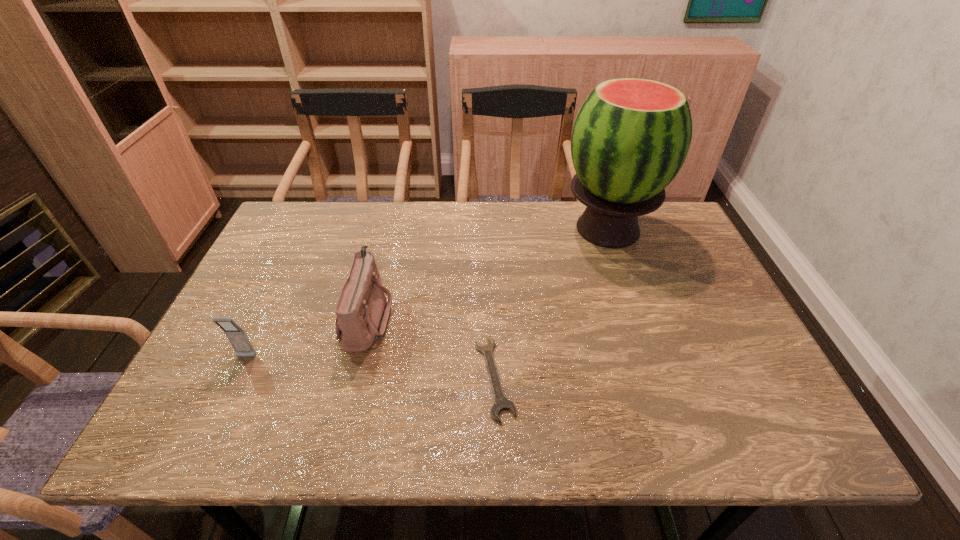
Where is `vacant area at the far right corner of the desktop`? The width and height of the screenshot is (960, 540). vacant area at the far right corner of the desktop is located at coordinates (663, 226).

I want to click on free space at the near right corner of the desktop, so click(737, 415).

I want to click on empty location between the third object from right to left and the leftmost object, so pyautogui.click(x=306, y=338).

I want to click on vacant area that lies between the cellular telephone and the rightmost object, so click(x=427, y=293).

The width and height of the screenshot is (960, 540). I want to click on vacant space that is in between the second object from right to left and the second object from left to right, so click(x=431, y=347).

Find the location of a particular element. empty space between the leftmost object and the third object from right to left is located at coordinates (306, 338).

The height and width of the screenshot is (540, 960). I want to click on vacant area that lies between the tallest object and the second object from left to right, so click(x=488, y=273).

Identify the location of unoccupied area between the watermelon and the cellular telephone. This screenshot has width=960, height=540. (427, 293).

At what (x,y) coordinates should I click in order to perform the action: click on empty location between the third object from right to left and the third object from left to right. Please return your answer as a coordinate pair (x, y). Image resolution: width=960 pixels, height=540 pixels. Looking at the image, I should click on (431, 347).

Identify the location of vacant point located between the leftmost object and the wrench. The width and height of the screenshot is (960, 540). (371, 367).